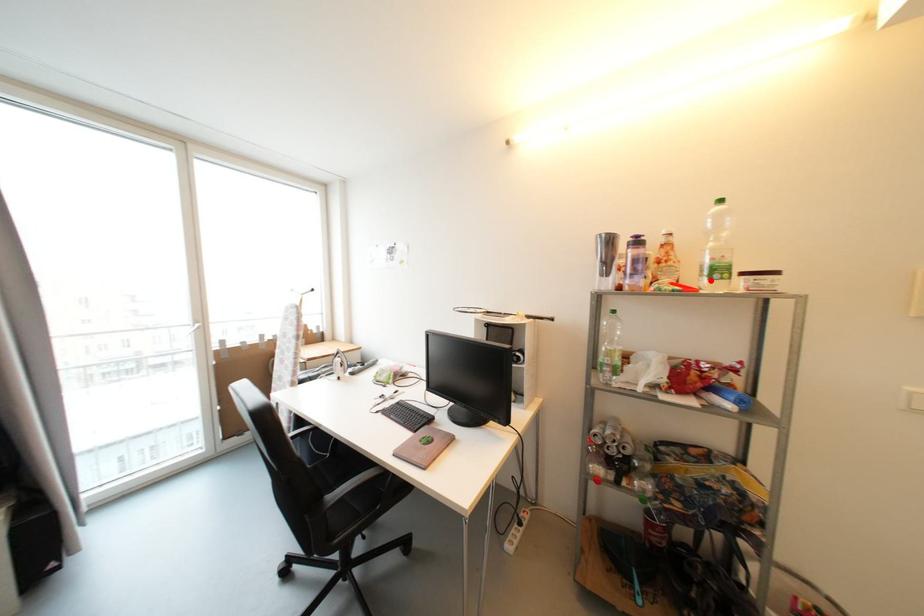
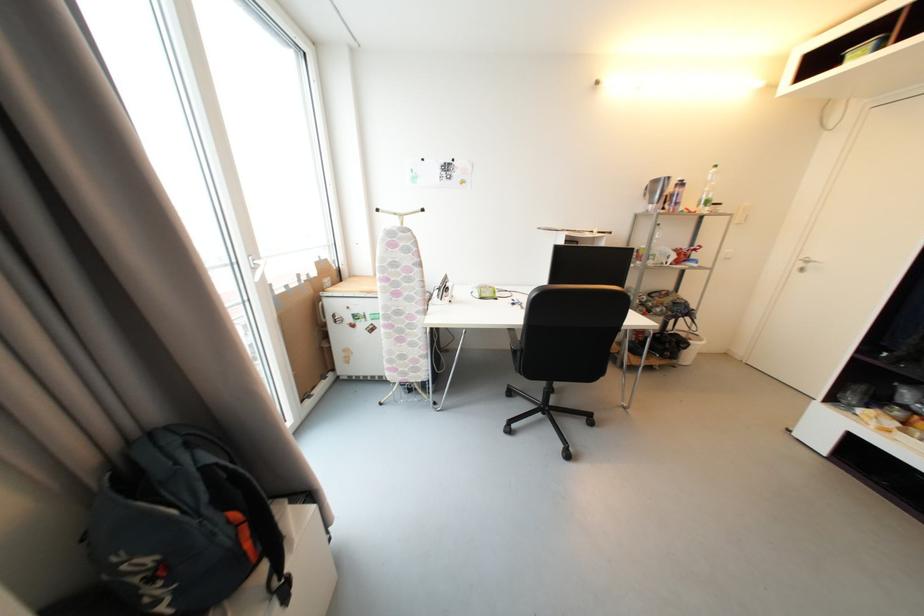
In the second image, find the point that corresponds to the highlighted location in the first image.

(707, 208)